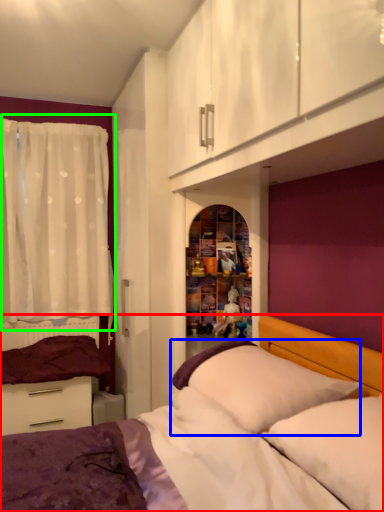
Question: Based on their relative distances, which object is nearer to bed (highlighted by a red box)? Choose from pillow (highlighted by a blue box) and curtain (highlighted by a green box).

Choices:
 (A) pillow
 (B) curtain

Answer: (A)